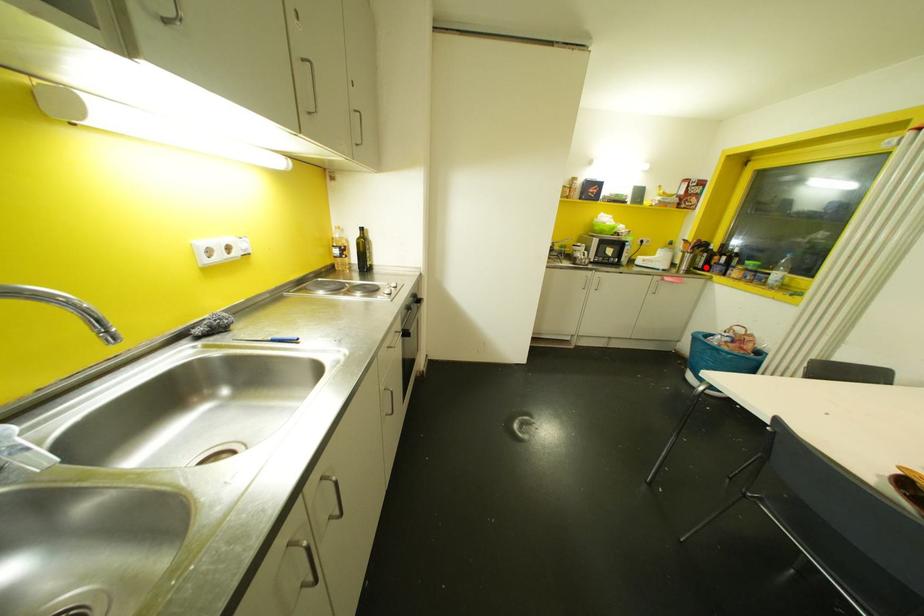
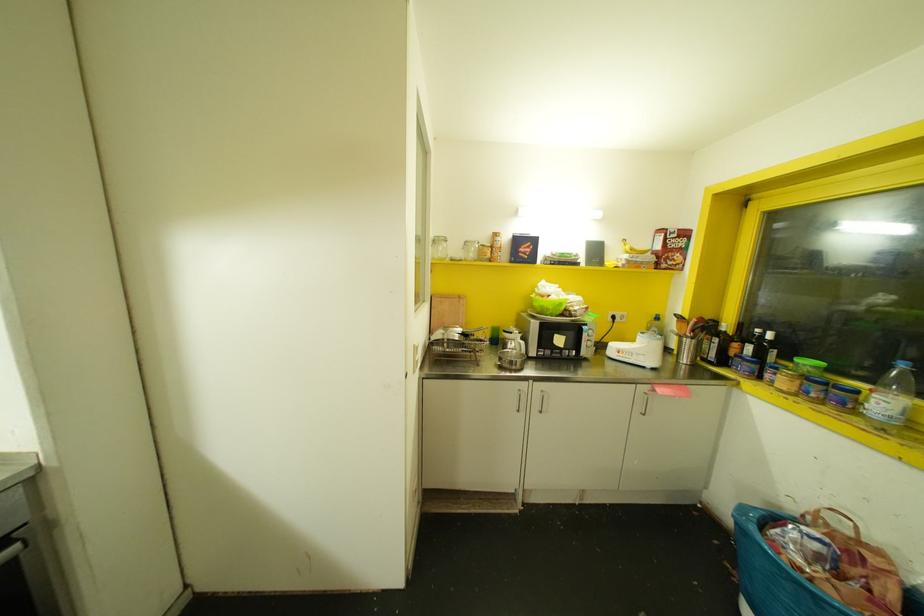
Find the pixel in the second image that matches the highlighted location in the first image.

(723, 361)